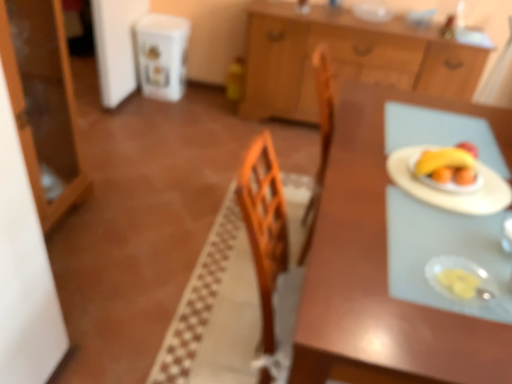
This screenshot has width=512, height=384. What do you see at coordinates (372, 12) in the screenshot?
I see `clear glass bowl at upper center, the 1th tableware viewed from the back` at bounding box center [372, 12].

Identify the location of matte wood cabinet at left, which is the 1th cabinetry in left-to-right order. (42, 103).

What are the coordinates of `translucent plastic plate at right, which is the 2th tableware in back-to-front order` in the screenshot? It's located at (460, 268).

This screenshot has width=512, height=384. In order to click on white paper plate at right in this screenshot , I will do `click(448, 192)`.

Choose the correct answer: Is clear glass bowl at upper center, which is counted as the second tableware, starting from the bottom, inside wooden table at center or outside it?

clear glass bowl at upper center, which is counted as the second tableware, starting from the bottom, is outside wooden table at center.

From the image's perspective, starting from the wooden table at center, which tableware is the 2nd one above? Please provide its 2D coordinates.

[(372, 12)]

Could you tell me if yellow matte bananas at right is turned towards translucent plastic plate at right, which appears as the 2th tableware when viewed from the right?

No, yellow matte bananas at right does not turn towards translucent plastic plate at right, which appears as the 2th tableware when viewed from the right.

Is point (429, 183) positioned before point (478, 276)?

No, (429, 183) is behind (478, 276).

Is yellow matte bananas at right placed right next to translucent plastic plate at right, which is the 2th tableware in back-to-front order?

They are not placed beside each other.

From a real-world perspective, is yellow matte bananas at right positioned above or below translucent plastic plate at right, the first tableware when ordered from left to right?

From a real-world perspective, yellow matte bananas at right is physically above translucent plastic plate at right, the first tableware when ordered from left to right.

Considering the sizes of objects white paper plate at right and clear glass bowl at upper center, the 1th tableware viewed from the back, in the image provided, who is shorter, white paper plate at right or clear glass bowl at upper center, the 1th tableware viewed from the back,?

With less height is white paper plate at right.

Is white paper plate at right spatially inside clear glass bowl at upper center, which appears as the 2th tableware when viewed from the front, or outside of it?

white paper plate at right lies outside clear glass bowl at upper center, which appears as the 2th tableware when viewed from the front.

Measure the distance from clear glass bowl at upper center, marked as the 2th tableware in a left-to-right arrangement, to yellow matte bananas at right.

They are 1.93 meters apart.

Which is more distant, (379, 15) or (428, 179)?

The point (379, 15) is more distant.

Is clear glass bowl at upper center, the 1th tableware viewed from the back, not inside yellow matte bananas at right?

Yes, clear glass bowl at upper center, the 1th tableware viewed from the back, is not within yellow matte bananas at right.

Is clear glass bowl at upper center, marked as the 2th tableware in a left-to-right arrangement, shorter than yellow matte bananas at right?

No, clear glass bowl at upper center, marked as the 2th tableware in a left-to-right arrangement, is not shorter than yellow matte bananas at right.

Is point (445, 189) in front of point (472, 81)?

That is True.

Can you confirm if yellow matte bananas at right is thinner than wooden cabinet at upper center, the second cabinetry from the front?

Yes, yellow matte bananas at right is thinner than wooden cabinet at upper center, the second cabinetry from the front.

In terms of height, does yellow matte bananas at right look taller or shorter compared to wooden cabinet at upper center, the second cabinetry from the front?

In the image, yellow matte bananas at right appears to be shorter than wooden cabinet at upper center, the second cabinetry from the front.

Can we say matte wood cabinet at left, the 2th cabinetry positioned from the back, lies outside wooden cabinet at upper center, arranged as the 2th cabinetry when viewed from the left?

Yes, matte wood cabinet at left, the 2th cabinetry positioned from the back, is not within wooden cabinet at upper center, arranged as the 2th cabinetry when viewed from the left.

From the image's perspective, is matte wood cabinet at left, which is the 1th cabinetry in left-to-right order, under wooden cabinet at upper center, the second cabinetry from the front?

Yes, from the image's perspective, matte wood cabinet at left, which is the 1th cabinetry in left-to-right order, is below wooden cabinet at upper center, the second cabinetry from the front.

Does matte wood cabinet at left, the 1th cabinetry in the front-to-back sequence, turn towards wooden cabinet at upper center, which appears as the 1th cabinetry when viewed from the back?

No, matte wood cabinet at left, the 1th cabinetry in the front-to-back sequence, is not facing towards wooden cabinet at upper center, which appears as the 1th cabinetry when viewed from the back.

Locate an element on the screen. cabinetry in front of the wooden cabinet at upper center, the 1th cabinetry in the right-to-left sequence is located at coordinates (42, 103).

Would you consider matte wood cabinet at left, the second cabinetry positioned from the right, to be distant from white paper plate at right?

Yes, matte wood cabinet at left, the second cabinetry positioned from the right, is far from white paper plate at right.

You are a GUI agent. You are given a task and a screenshot of the screen. Output one action in this format:
    pyautogui.click(x=<x>, y=<y>)
    Task: Click on the 1st cabinetry above the white paper plate at right (from the image's perspective)
    
    Given the screenshot: What is the action you would take?
    pos(42,103)

From the picture: Who is taller, matte wood cabinet at left, the 2th cabinetry positioned from the back, or white paper plate at right?

With more height is matte wood cabinet at left, the 2th cabinetry positioned from the back.

Does matte wood cabinet at left, the 1th cabinetry in the front-to-back sequence, appear on the left side of white paper plate at right?

Yes, matte wood cabinet at left, the 1th cabinetry in the front-to-back sequence, is to the left of white paper plate at right.

Find the location of a particular element. The width and height of the screenshot is (512, 384). table below the clear glass bowl at upper center, which appears as the 2th tableware when viewed from the front (from a real-world perspective) is located at coordinates (382, 271).

Where is `tableware below the yellow matte bananas at right (from the image's perspective)`? This screenshot has width=512, height=384. tableware below the yellow matte bananas at right (from the image's perspective) is located at coordinates (460, 268).

Based on their spatial positions, is matte wood cabinet at left, the 2th cabinetry positioned from the back, or clear glass bowl at upper center, arranged as the first tableware when viewed from the top, closer to yellow matte bananas at right?

matte wood cabinet at left, the 2th cabinetry positioned from the back, is closer to yellow matte bananas at right.

From the image, which object appears to be farther from wooden cabinet at upper center, the second cabinetry from the front, clear glass bowl at upper center, marked as the 2th tableware in a left-to-right arrangement, or white paper plate at right?

white paper plate at right is further to wooden cabinet at upper center, the second cabinetry from the front.

Considering their positions, is matte wood cabinet at left, the second cabinetry positioned from the right, positioned further to wooden table at center than translucent plastic plate at right, placed as the first tableware when sorted from bottom to top?

matte wood cabinet at left, the second cabinetry positioned from the right, is positioned further to the anchor wooden table at center.

Considering their positions, is wooden table at center positioned closer to clear glass bowl at upper center, marked as the 2th tableware in a left-to-right arrangement, than white paper plate at right?

white paper plate at right is closer to clear glass bowl at upper center, marked as the 2th tableware in a left-to-right arrangement.

When comparing their distances from white paper plate at right, does translucent plastic plate at right, which appears as the 2th tableware when viewed from the right, or wooden table at center seem closer?

Result: wooden table at center.

Based on their spatial positions, is wooden table at center or yellow matte bananas at right further from clear glass bowl at upper center, the 1th tableware viewed from the back?

The object further to clear glass bowl at upper center, the 1th tableware viewed from the back, is wooden table at center.

Considering their positions, is translucent plastic plate at right, which ranks as the 1th tableware in front-to-back order, positioned further to wooden table at center than clear glass bowl at upper center, the first tableware viewed from the right?

Among the two, clear glass bowl at upper center, the first tableware viewed from the right, is located further to wooden table at center.

Based on their spatial positions, is clear glass bowl at upper center, which is counted as the second tableware, starting from the bottom, or wooden table at center closer to yellow matte bananas at right?

wooden table at center.

Identify the location of fruit dish between matte wood cabinet at left, the second cabinetry positioned from the right, and clear glass bowl at upper center, which appears as the 2th tableware when viewed from the front. Image resolution: width=512 pixels, height=384 pixels. (447, 169).

Locate an element on the screen. This screenshot has width=512, height=384. paper plate located between translucent plastic plate at right, placed as the first tableware when sorted from bottom to top, and wooden cabinet at upper center, the 1th cabinetry in the right-to-left sequence, in the depth direction is located at coordinates (448, 192).

You are a GUI agent. You are given a task and a screenshot of the screen. Output one action in this format:
    pyautogui.click(x=<x>, y=<y>)
    Task: Click on the tableware between matte wood cabinet at left, the 2th cabinetry positioned from the back, and yellow matte bananas at right, in the horizontal direction
    Image resolution: width=512 pixels, height=384 pixels.
    Given the screenshot: What is the action you would take?
    pyautogui.click(x=460, y=268)

Image resolution: width=512 pixels, height=384 pixels. Identify the location of paper plate situated between matte wood cabinet at left, the second cabinetry positioned from the right, and wooden cabinet at upper center, which appears as the 1th cabinetry when viewed from the back, from left to right. (448, 192).